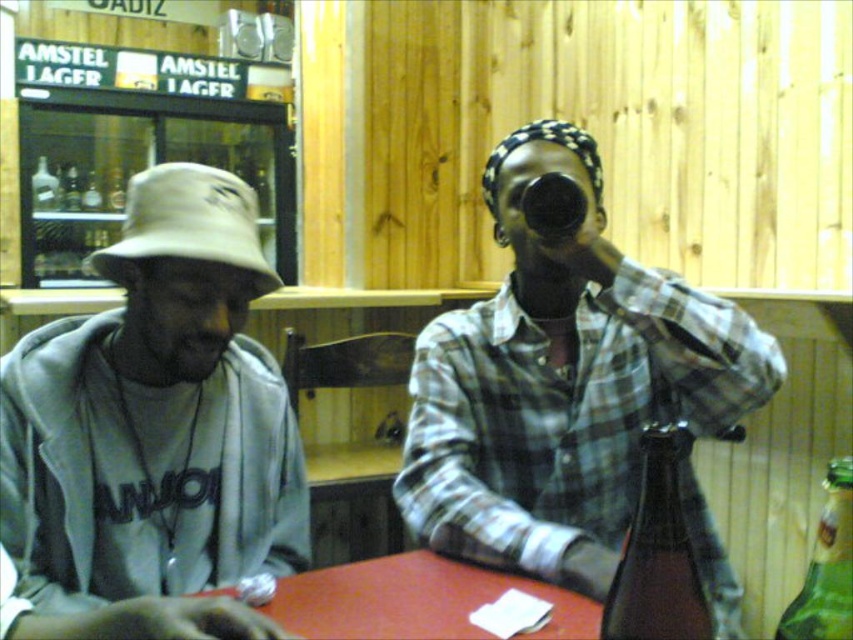
Is white fabric hat at left smaller than black plastic cup at upper center?

No, white fabric hat at left is not smaller than black plastic cup at upper center.

Is white fabric hat at left bigger than black plastic cup at upper center?

Yes, white fabric hat at left is bigger than black plastic cup at upper center.

Which is behind, point (167, 253) or point (585, 209)?

Point (585, 209)

At what (x,y) coordinates should I click in order to perform the action: click on white fabric hat at left. Please return your answer as a coordinate pair (x, y). Image resolution: width=853 pixels, height=640 pixels. Looking at the image, I should click on (187, 224).

Does green glass bottle at right appear on the right side of black plastic cup at upper center?

Correct, you'll find green glass bottle at right to the right of black plastic cup at upper center.

Which is more to the left, green glass bottle at right or black plastic cup at upper center?

Positioned to the left is black plastic cup at upper center.

You are a GUI agent. You are given a task and a screenshot of the screen. Output one action in this format:
    pyautogui.click(x=<x>, y=<y>)
    Task: Click on the green glass bottle at right
    Image resolution: width=853 pixels, height=640 pixels.
    Given the screenshot: What is the action you would take?
    pyautogui.click(x=827, y=566)

Does brown glass bottle at lower right have a lesser width compared to white fabric hat at left?

Yes, brown glass bottle at lower right is thinner than white fabric hat at left.

Identify the location of brown glass bottle at lower right. (659, 552).